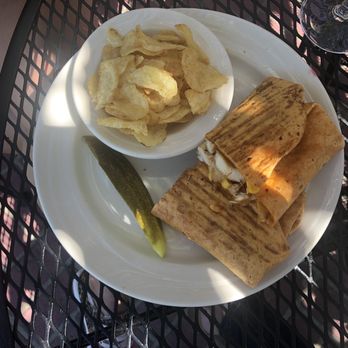
At what (x,y) coordinates should I click in order to perform the action: click on grout lines. Please return your answer as a coordinate pair (x, y). Looking at the image, I should click on (57, 275).